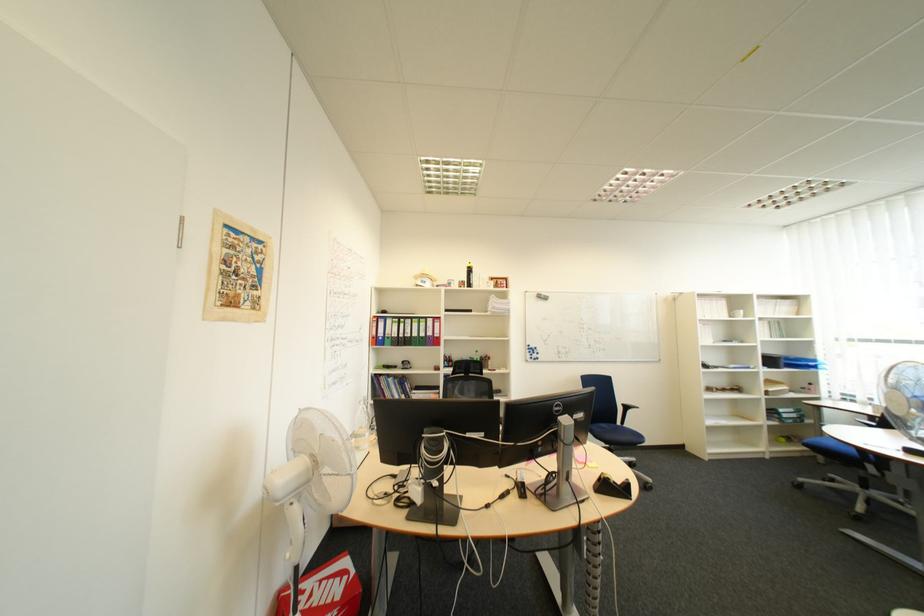
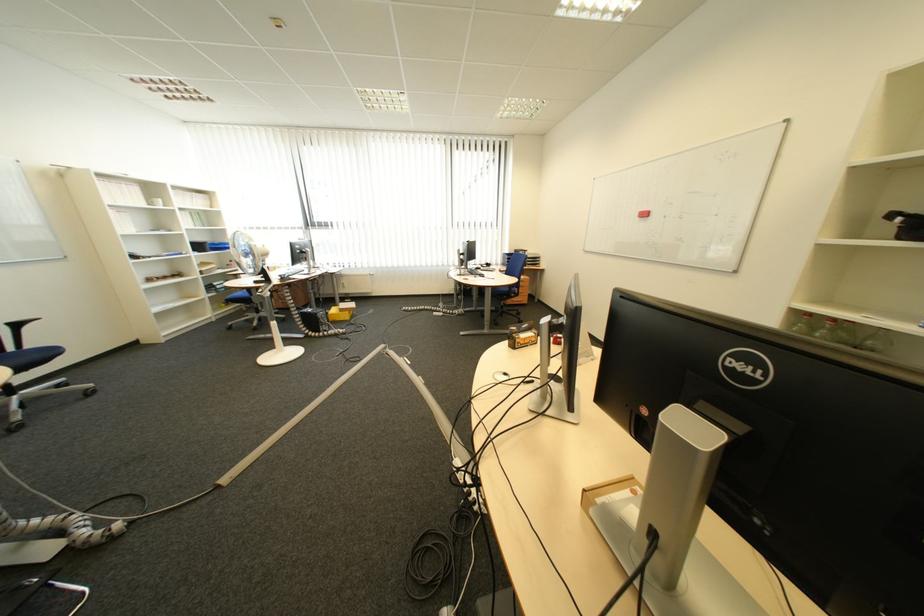
The point at [737,318] is marked in the first image. Where is the corresponding point in the second image?

(155, 206)